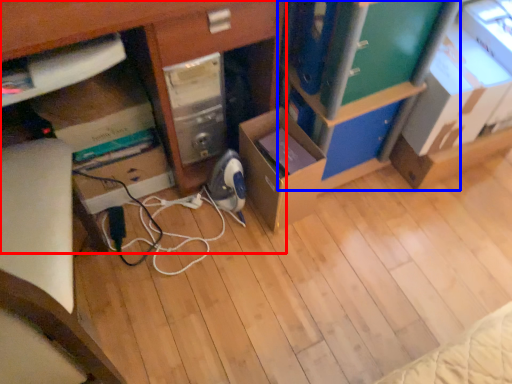
Question: Which of the following is the farthest to the observer, desk (highlighted by a red box) or bookshelf (highlighted by a blue box)?

Choices:
 (A) desk
 (B) bookshelf

Answer: (B)